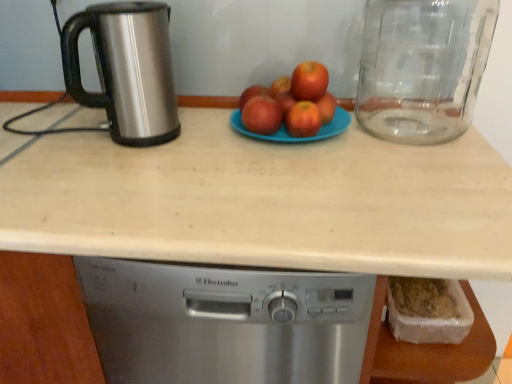
This screenshot has height=384, width=512. In order to click on vacant space situated on the left part of matte blue plate at center in this screenshot , I will do `click(197, 137)`.